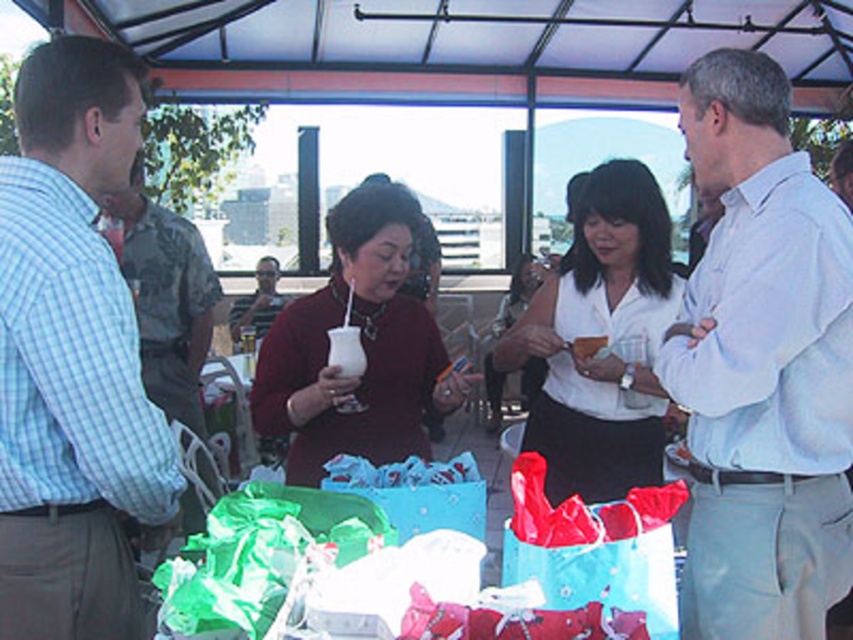
Measure the distance between light blue checkered shirt at left and white matte shirt at center.

The distance of light blue checkered shirt at left from white matte shirt at center is 4.43 feet.

Looking at this image, does light blue checkered shirt at left appear under white matte shirt at center?

Yes.

Does point (36, 280) lie in front of point (646, 243)?

Yes.

Find the location of a particular element. The height and width of the screenshot is (640, 853). light blue checkered shirt at left is located at coordinates (73, 356).

From the picture: Is shiny red plastic bag at center closer to the viewer compared to matte black shirt at center?

Yes, shiny red plastic bag at center is closer to the viewer.

Is shiny red plastic bag at center bigger than matte black shirt at center?

No.

Is point (577, 604) closer to camera compared to point (231, 336)?

Yes, point (577, 604) is in front of point (231, 336).

Locate an element on the screen. shiny red plastic bag at center is located at coordinates point(595,547).

Does point (329, 440) come farther from viewer compared to point (589, 340)?

No, (329, 440) is closer to viewer.

Between point (442, 355) and point (579, 353), which one is positioned in front?

Point (442, 355) is in front.

The image size is (853, 640). Identify the location of matte red sweater at center. (361, 346).

The height and width of the screenshot is (640, 853). What are the coordinates of `matte red sweater at center` in the screenshot? It's located at (361, 346).